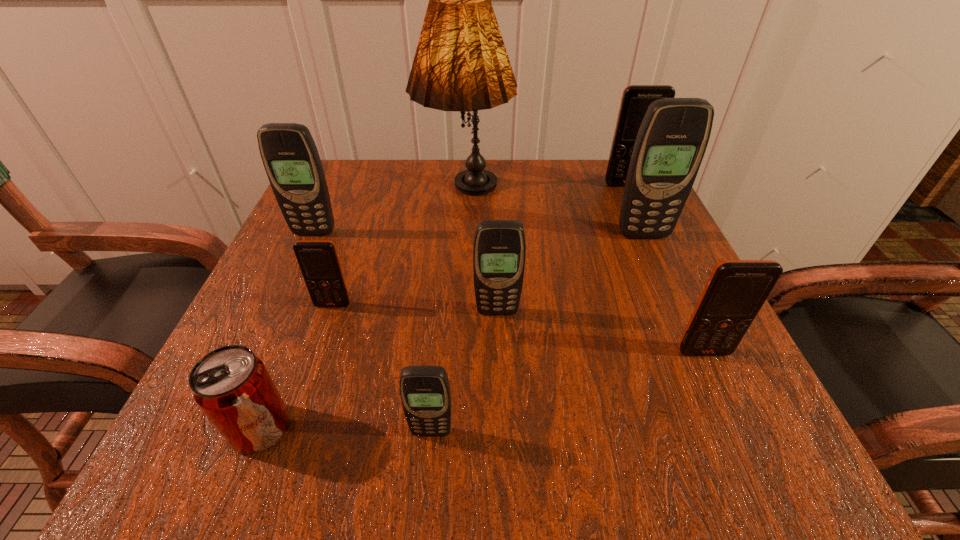
Locate an element on the screen. The width and height of the screenshot is (960, 540). the second biggest orange cellular telephone is located at coordinates (736, 290).

Locate an element on the screen. the second nearest orange cellular telephone is located at coordinates (318, 260).

Find the location of `the smallest orange cellular telephone`. the smallest orange cellular telephone is located at coordinates (318, 260).

The width and height of the screenshot is (960, 540). Identify the location of the third gray cellular telephone from right to left. (425, 393).

Locate an element on the screen. Image resolution: width=960 pixels, height=540 pixels. the nearest cellular telephone is located at coordinates (425, 393).

Find the location of a particular element. red pop soda is located at coordinates (231, 385).

Image resolution: width=960 pixels, height=540 pixels. I want to click on vacant position located 0.320m on the front-facing side of the lampshade, so click(458, 367).

This screenshot has width=960, height=540. I want to click on vacant area situated on the screen of the eighth shortest object, so click(x=706, y=377).

Image resolution: width=960 pixels, height=540 pixels. Identify the location of free space located 0.310m on the screen of the biggest orange cellular telephone. [x=670, y=281].

This screenshot has width=960, height=540. I want to click on free space located 0.110m on the screen of the leftmost gray cellular telephone, so click(296, 274).